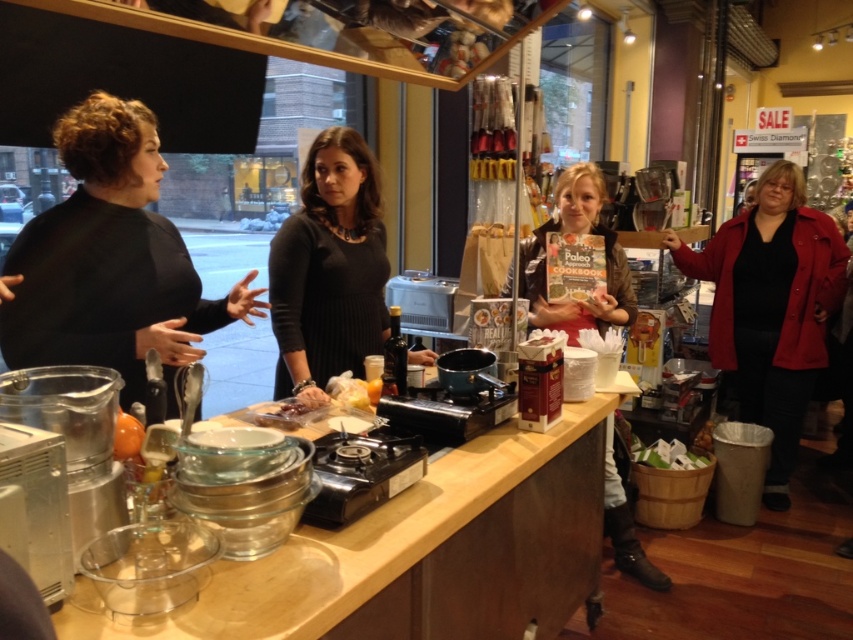
Is black matte sweater at left closer to camera compared to matte red coat at right?

That is True.

Between point (71, 214) and point (775, 372), which one is positioned in front?

Point (71, 214) is in front.

Where is `black matte sweater at left`? black matte sweater at left is located at coordinates (111, 260).

Describe the element at coordinates (111, 260) in the screenshot. The height and width of the screenshot is (640, 853). I see `black matte sweater at left` at that location.

Is black matte sweater at left to the right of black matte dress at center from the viewer's perspective?

No, black matte sweater at left is not to the right of black matte dress at center.

Who is more distant from viewer, (122, 401) or (366, 212)?

The point (366, 212) is behind.

Locate an element on the screen. The image size is (853, 640). black matte sweater at left is located at coordinates click(111, 260).

Which is behind, point (845, 248) or point (387, 364)?

Positioned behind is point (845, 248).

Is matte red coat at right thinner than translucent glass bottle at center?

No, matte red coat at right is not thinner than translucent glass bottle at center.

Between point (778, 276) and point (397, 330), which one is positioned behind?

Point (778, 276)

Locate an element on the screen. matte red coat at right is located at coordinates (770, 307).